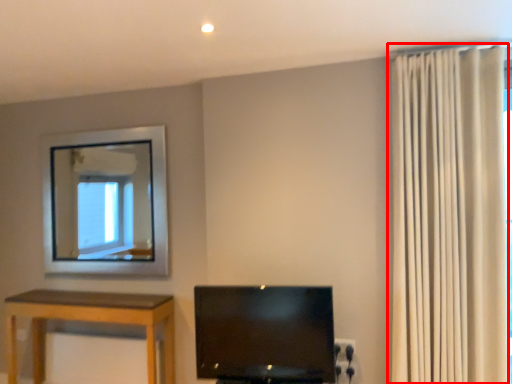
Question: In this image, where is curtain (annotated by the red box) located relative to television?

Choices:
 (A) right
 (B) left

Answer: (A)